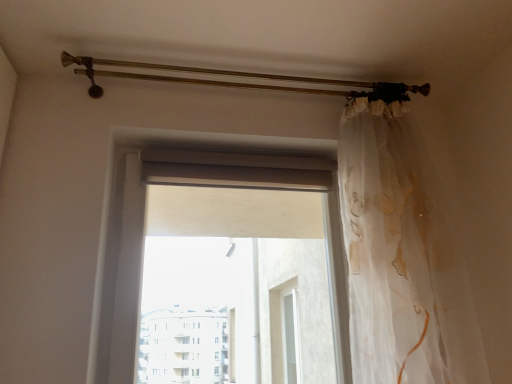
The width and height of the screenshot is (512, 384). What do you see at coordinates (401, 257) in the screenshot? I see `translucent white curtain at right` at bounding box center [401, 257].

Find the location of `translucent white curtain at right`. translucent white curtain at right is located at coordinates (401, 257).

The height and width of the screenshot is (384, 512). What do you see at coordinates (198, 183) in the screenshot?
I see `translucent fabric at center` at bounding box center [198, 183].

Locate an element on the screen. Image resolution: width=512 pixels, height=384 pixels. translucent fabric at center is located at coordinates (198, 183).

Where is `translucent white curtain at right`? translucent white curtain at right is located at coordinates (401, 257).

Can you confirm if translucent fabric at center is positioned to the left of translucent white curtain at right?

Yes, translucent fabric at center is to the left of translucent white curtain at right.

Which object is further away from the camera taking this photo, translucent fabric at center or translucent white curtain at right?

translucent fabric at center is further from the camera.

Which is in front, point (130, 209) or point (371, 352)?

The point (371, 352) is closer to the camera.

From the image's perspective, is translucent fabric at center on top of translucent white curtain at right?

No, from the image's perspective, translucent fabric at center is not on top of translucent white curtain at right.

From a real-world perspective, between translucent fabric at center and translucent white curtain at right, who is vertically higher?

translucent white curtain at right.

Is translucent fabric at center wider than translucent white curtain at right?

Incorrect, the width of translucent fabric at center does not surpass that of translucent white curtain at right.

Based on the photo, between translucent fabric at center and translucent white curtain at right, which one has less height?

With less height is translucent fabric at center.

Between translucent fabric at center and translucent white curtain at right, which one has smaller size?

translucent fabric at center.

Is translucent white curtain at right completely or partially inside translucent fabric at center?

No, translucent white curtain at right is not a part of translucent fabric at center.

Can you see translucent fabric at center touching translucent white curtain at right?

No, translucent fabric at center is not next to translucent white curtain at right.

Is translucent fabric at center facing towards translucent white curtain at right?

Yes, translucent fabric at center is aimed at translucent white curtain at right.

How many degrees apart are the facing directions of translucent fabric at center and translucent white curtain at right?

There is a 1.03-degree angle between the facing directions of translucent fabric at center and translucent white curtain at right.

Measure the distance between translucent fabric at center and translucent white curtain at right.

translucent fabric at center is 10.60 inches from translucent white curtain at right.

At what (x,y) coordinates should I click in order to perform the action: click on window below the translucent white curtain at right (from the image's perspective). Please return your answer as a coordinate pair (x, y). The image size is (512, 384). Looking at the image, I should click on click(198, 183).

Consider the image. Between translucent white curtain at right and translucent fabric at center, which one appears on the right side from the viewer's perspective?

translucent white curtain at right is more to the right.

Considering the relative positions of translucent white curtain at right and translucent fabric at center in the image provided, is translucent white curtain at right in front of translucent fabric at center?

Yes, it is in front of translucent fabric at center.

Which is in front, point (378, 128) or point (118, 360)?

The point (118, 360) is closer to the camera.

Based on the photo, from the image's perspective, relative to translucent fabric at center, is translucent white curtain at right above or below?

From the image's perspective, translucent white curtain at right appears above translucent fabric at center.

From a real-world perspective, is translucent white curtain at right physically below translucent fabric at center?

No, from a real-world perspective, translucent white curtain at right is not under translucent fabric at center.

Which object is thinner, translucent white curtain at right or translucent fabric at center?

translucent fabric at center.

Does translucent white curtain at right have a lesser height compared to translucent fabric at center?

Incorrect, the height of translucent white curtain at right does not fall short of that of translucent fabric at center.

Considering the relative sizes of translucent white curtain at right and translucent fabric at center in the image provided, is translucent white curtain at right bigger than translucent fabric at center?

Yes, translucent white curtain at right is bigger than translucent fabric at center.

Is translucent white curtain at right positioned beyond the bounds of translucent fabric at center?

Indeed, translucent white curtain at right is completely outside translucent fabric at center.

Does translucent white curtain at right touch translucent fabric at center?

translucent white curtain at right is not next to translucent fabric at center, and they're not touching.

Is translucent white curtain at right turned away from translucent fabric at center?

No, translucent fabric at center is not at the back of translucent white curtain at right.

Find the location of `curtain that appears in front of the translucent fabric at center`. curtain that appears in front of the translucent fabric at center is located at coordinates (401, 257).

This screenshot has height=384, width=512. In order to click on window located underneath the translucent white curtain at right (from a real-world perspective) in this screenshot , I will do `click(198, 183)`.

Where is `window below the translucent white curtain at right (from the image's perspective)`? This screenshot has height=384, width=512. window below the translucent white curtain at right (from the image's perspective) is located at coordinates (198, 183).